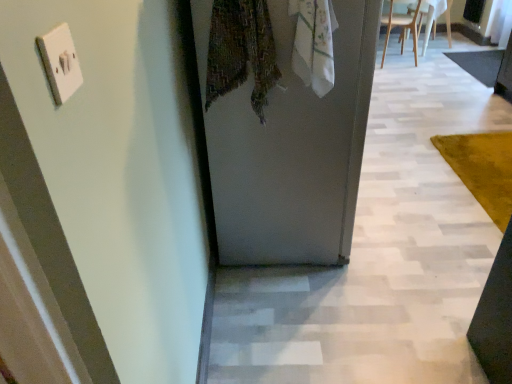
Question: Is white cotton scarf at upper center wider or thinner than white plastic switch at upper left?

Choices:
 (A) wide
 (B) thin

Answer: (A)

Question: Considering the positions of point (324, 33) and point (46, 44), is point (324, 33) closer or farther from the camera than point (46, 44)?

Choices:
 (A) farther
 (B) closer

Answer: (A)

Question: Which object is positioned farthest from the white wooden chair at upper right, the 2th chair from the right?

Choices:
 (A) dark gray carpet at right, the second mat ordered from the bottom
 (B) yellow plush rug at right, which is the 1th mat from bottom to top
 (C) white plastic switch at upper left
 (D) white matte door at center
 (E) white plastic chair at upper right, the 2th chair positioned from the left

Answer: (C)

Question: Based on their relative distances, which object is nearer to the yellow plush rug at right, the 1th mat in the front-to-back sequence?

Choices:
 (A) white plastic switch at upper left
 (B) dark gray carpet at right, positioned as the 2th mat in front-to-back order
 (C) white wooden chair at upper right, the 2th chair from the right
 (D) textured fabric clothesline at center
 (E) white plastic chair at upper right, the 2th chair positioned from the left

Answer: (B)